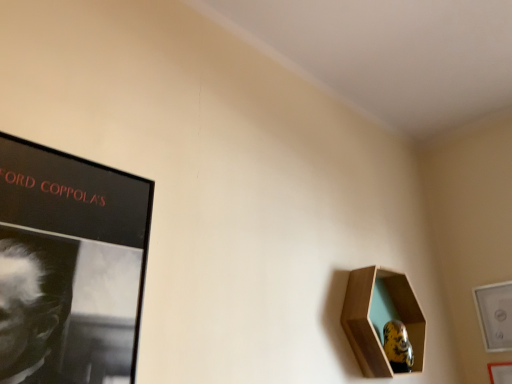
Question: From a real-world perspective, is wooden hexagonal frame at lower right, which is the 1th picture frame in left-to-right order, under white glossy picture frame at lower right, placed as the 2th picture frame when sorted from left to right?

Choices:
 (A) no
 (B) yes

Answer: (B)

Question: Is wooden hexagonal frame at lower right, which is the 1th picture frame in left-to-right order, smaller than white glossy picture frame at lower right, placed as the 2th picture frame when sorted from left to right?

Choices:
 (A) no
 (B) yes

Answer: (A)

Question: Can you confirm if wooden hexagonal frame at lower right, marked as the third picture frame in a right-to-left arrangement, is thinner than white glossy picture frame at lower right, placed as the 2th picture frame when sorted from left to right?

Choices:
 (A) yes
 (B) no

Answer: (B)

Question: Is wooden hexagonal frame at lower right, marked as the third picture frame in a right-to-left arrangement, positioned with its back to white glossy picture frame at lower right, the second picture frame when ordered from right to left?

Choices:
 (A) no
 (B) yes

Answer: (A)

Question: Can you confirm if wooden hexagonal frame at lower right, which is the 1th picture frame in left-to-right order, is shorter than white glossy picture frame at lower right, placed as the 2th picture frame when sorted from left to right?

Choices:
 (A) yes
 (B) no

Answer: (B)

Question: From a real-world perspective, relative to wooden hexagonal frame at lower right, which is the 1th picture frame in left-to-right order, is wooden picture frame at lower right, marked as the third picture frame in a left-to-right arrangement, vertically above or below?

Choices:
 (A) below
 (B) above

Answer: (A)

Question: Would you say wooden picture frame at lower right, marked as the third picture frame in a left-to-right arrangement, is to the left or to the right of wooden hexagonal frame at lower right, which is the 1th picture frame in left-to-right order, in the picture?

Choices:
 (A) left
 (B) right

Answer: (B)

Question: From their relative heights in the image, would you say wooden picture frame at lower right, arranged as the first picture frame when viewed from the right, is taller or shorter than wooden hexagonal frame at lower right, marked as the third picture frame in a right-to-left arrangement?

Choices:
 (A) short
 (B) tall

Answer: (A)

Question: In terms of width, does wooden picture frame at lower right, marked as the third picture frame in a left-to-right arrangement, look wider or thinner when compared to wooden hexagonal frame at lower right, marked as the third picture frame in a right-to-left arrangement?

Choices:
 (A) wide
 (B) thin

Answer: (B)

Question: Visually, is wooden picture frame at lower right, arranged as the first picture frame when viewed from the right, positioned to the left or to the right of white glossy picture frame at lower right, placed as the 2th picture frame when sorted from left to right?

Choices:
 (A) right
 (B) left

Answer: (A)

Question: Is wooden picture frame at lower right, marked as the third picture frame in a left-to-right arrangement, bigger or smaller than white glossy picture frame at lower right, placed as the 2th picture frame when sorted from left to right?

Choices:
 (A) big
 (B) small

Answer: (B)

Question: In the image, is wooden picture frame at lower right, marked as the third picture frame in a left-to-right arrangement, positioned in front of or behind white glossy picture frame at lower right, placed as the 2th picture frame when sorted from left to right?

Choices:
 (A) front
 (B) behind

Answer: (A)

Question: From a real-world perspective, relative to white glossy picture frame at lower right, placed as the 2th picture frame when sorted from left to right, is wooden picture frame at lower right, arranged as the first picture frame when viewed from the right, vertically above or below?

Choices:
 (A) below
 (B) above

Answer: (A)

Question: Is white glossy picture frame at lower right, placed as the 2th picture frame when sorted from left to right, wider or thinner than wooden hexagonal frame at lower right, which is the 1th picture frame in left-to-right order?

Choices:
 (A) wide
 (B) thin

Answer: (B)

Question: Relative to wooden hexagonal frame at lower right, which is the 1th picture frame in left-to-right order, is white glossy picture frame at lower right, placed as the 2th picture frame when sorted from left to right, in front or behind?

Choices:
 (A) front
 (B) behind

Answer: (B)